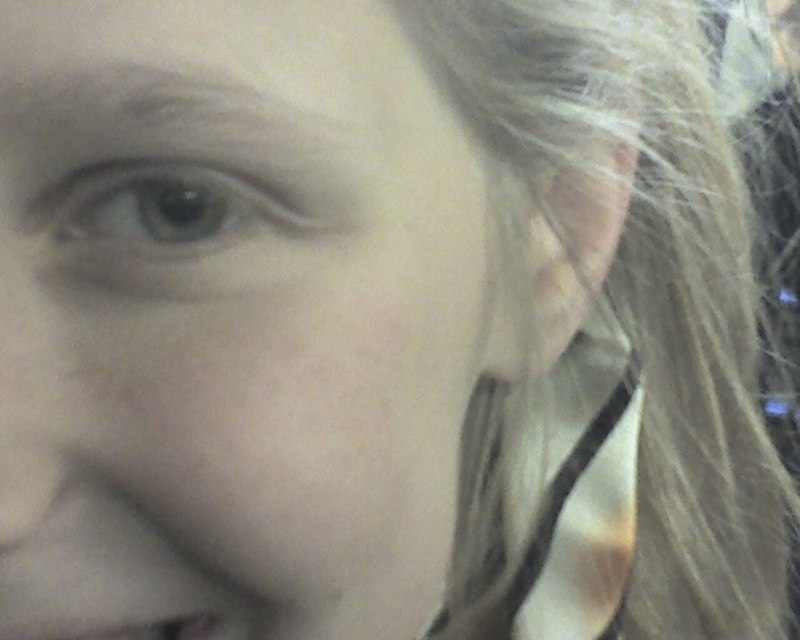
Question: Can you confirm if blonde hair at right is positioned above green matte eye at upper left?

Choices:
 (A) no
 (B) yes

Answer: (A)

Question: Among these points, which one is farthest from the camera?

Choices:
 (A) (262, 182)
 (B) (114, 61)

Answer: (A)

Question: Among these objects, which one is farthest from the camera?

Choices:
 (A) blonde hair at right
 (B) gray matte eyebrow at upper left

Answer: (A)

Question: Is smooth skin at center positioned before gray matte eyebrow at upper left?

Choices:
 (A) yes
 (B) no

Answer: (A)

Question: Does smooth skin at center have a smaller size compared to blonde hair at right?

Choices:
 (A) yes
 (B) no

Answer: (A)

Question: Which of the following is the farthest from the observer?

Choices:
 (A) smooth skin at center
 (B) blonde hair at right

Answer: (B)